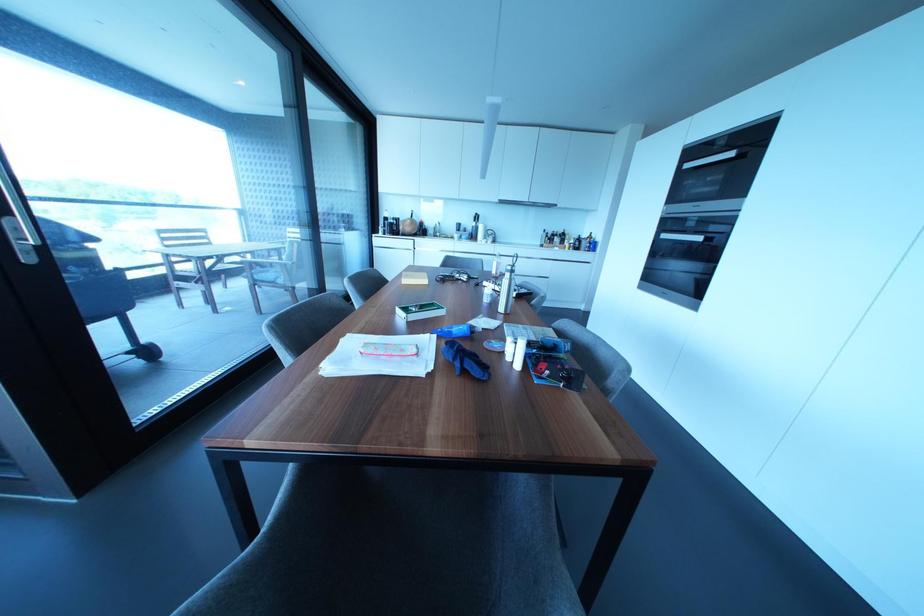
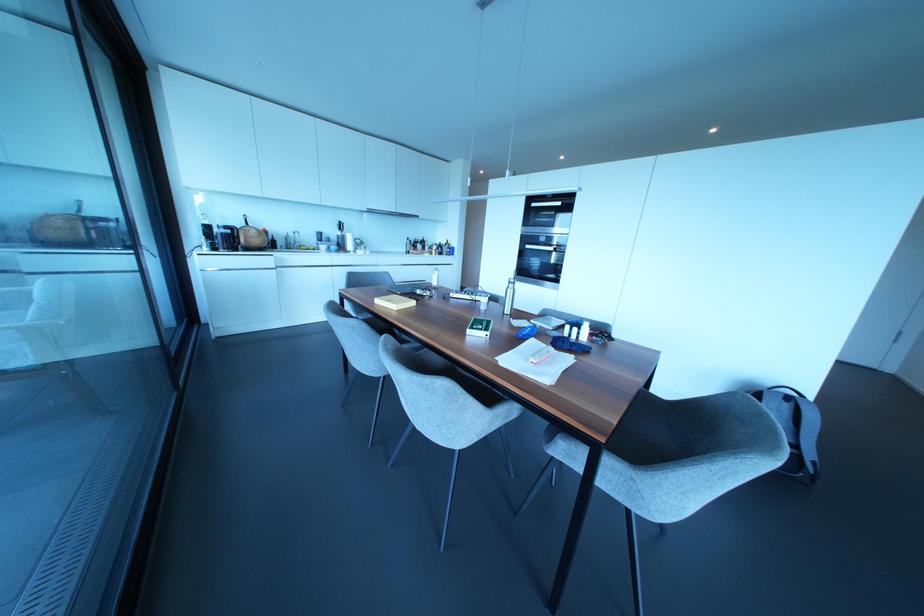
Where in the second image is the point corresponding to [397,310] from the first image?

(468, 331)